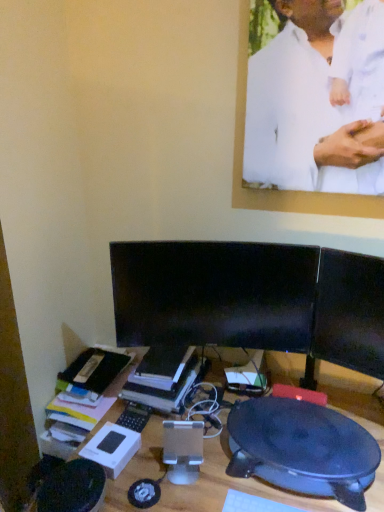
The height and width of the screenshot is (512, 384). Identify the location of black plastic round table at lower right. (302, 449).

Image resolution: width=384 pixels, height=512 pixels. What do you see at coordinates (349, 313) in the screenshot?
I see `black glossy monitor at center, positioned as the first computer monitor in right-to-left order` at bounding box center [349, 313].

Describe the element at coordinates (163, 377) in the screenshot. I see `hardcover book at center` at that location.

Identify the location of black glossy monitor at center, which is the first computer monitor in left-to-right order. Image resolution: width=384 pixels, height=512 pixels. (214, 294).

From the image's perspective, between black plastic desk at center and black plastic round table at lower right, who is located below?

black plastic desk at center.

Which is nearer, (x=255, y=481) or (x=255, y=454)?

Clearly, point (x=255, y=481) is closer to the camera than point (x=255, y=454).

Is black plastic desk at center to the right of black plastic round table at lower right from the viewer's perspective?

In fact, black plastic desk at center is to the left of black plastic round table at lower right.

In terms of height, does white matte shirt at upper center look taller or shorter compared to black glossy monitor at center, positioned as the first computer monitor in right-to-left order?

white matte shirt at upper center is taller than black glossy monitor at center, positioned as the first computer monitor in right-to-left order.

Which is in front, white matte shirt at upper center or black glossy monitor at center, which is the second computer monitor in left-to-right order?

white matte shirt at upper center.

Is white matte shirt at upper center placed right next to black glossy monitor at center, positioned as the first computer monitor in right-to-left order?

white matte shirt at upper center and black glossy monitor at center, positioned as the first computer monitor in right-to-left order, are not in contact.

From a real-world perspective, is white matte shirt at upper center above or below black glossy monitor at center, which is the second computer monitor in left-to-right order?

white matte shirt at upper center is situated higher than black glossy monitor at center, which is the second computer monitor in left-to-right order, in the real world.

Does hardcover book at center come behind black glossy monitor at center, positioned as the first computer monitor in right-to-left order?

Yes, it is.

Is point (129, 393) positioned in front of point (321, 322)?

No, it is behind (321, 322).

Can you confirm if hardcover book at center is wider than black glossy monitor at center, which is the second computer monitor in left-to-right order?

Yes.

Is the surface of hardcover book at center in direct contact with black glossy monitor at center, positioned as the first computer monitor in right-to-left order?

No, hardcover book at center is not with black glossy monitor at center, positioned as the first computer monitor in right-to-left order.

Relative to white matte shirt at upper center, is black glossy monitor at center, the second computer monitor positioned from the right, in front or behind?

In the image, black glossy monitor at center, the second computer monitor positioned from the right, appears behind white matte shirt at upper center.

Which is more to the left, black glossy monitor at center, which is the first computer monitor in left-to-right order, or white matte shirt at upper center?

black glossy monitor at center, which is the first computer monitor in left-to-right order, is more to the left.

Are black glossy monitor at center, the second computer monitor positioned from the right, and white matte shirt at upper center beside each other?

There is a gap between black glossy monitor at center, the second computer monitor positioned from the right, and white matte shirt at upper center.

Between point (188, 271) and point (353, 116), which one is positioned behind?

The point (188, 271) is behind.

Does white matte shirt at upper center come behind black plastic round table at lower right?

Yes, the depth of white matte shirt at upper center is greater than that of black plastic round table at lower right.

Consider the image. Is white matte shirt at upper center wider or thinner than black plastic round table at lower right?

white matte shirt at upper center is thinner than black plastic round table at lower right.

From a real-world perspective, which is physically above, white matte shirt at upper center or black plastic round table at lower right?

In real-world perspective, white matte shirt at upper center is above.

Is black plastic round table at lower right situated inside black glossy monitor at center, positioned as the first computer monitor in right-to-left order, or outside?

black plastic round table at lower right is outside black glossy monitor at center, positioned as the first computer monitor in right-to-left order.

From the image's perspective, relative to black glossy monitor at center, which is the second computer monitor in left-to-right order, is black plastic round table at lower right above or below?

From the image's perspective, black plastic round table at lower right appears below black glossy monitor at center, which is the second computer monitor in left-to-right order.

Considering the positions of points (233, 407) and (322, 273), is point (233, 407) closer to camera compared to point (322, 273)?

That is False.

Between black plastic round table at lower right and black glossy monitor at center, which is the second computer monitor in left-to-right order, which one has smaller width?

With smaller width is black glossy monitor at center, which is the second computer monitor in left-to-right order.

From a real-world perspective, who is located higher, hardcover book at center or white matte shirt at upper center?

white matte shirt at upper center, from a real-world perspective.

Considering the relative sizes of hardcover book at center and white matte shirt at upper center in the image provided, is hardcover book at center thinner than white matte shirt at upper center?

No, hardcover book at center is not thinner than white matte shirt at upper center.

Which is more to the left, hardcover book at center or white matte shirt at upper center?

From the viewer's perspective, hardcover book at center appears more on the left side.

Locate an element on the screen. desk located in front of the black plastic round table at lower right is located at coordinates (225, 486).

Image resolution: width=384 pixels, height=512 pixels. Identify the location of computer monitor on the right side of white matte shirt at upper center. (349, 313).

Considering their positions, is black glossy monitor at center, which is the second computer monitor in left-to-right order, positioned further to black plastic desk at center than black plastic round table at lower right?

The object further to black plastic desk at center is black glossy monitor at center, which is the second computer monitor in left-to-right order.

Which object lies nearer to the anchor point white matte shirt at upper center, hardcover book at center or black glossy monitor at center, the second computer monitor positioned from the right?

Among the two, black glossy monitor at center, the second computer monitor positioned from the right, is located nearer to white matte shirt at upper center.

From the picture: Looking at the image, which one is located further to black glossy monitor at center, which is the first computer monitor in left-to-right order, hardcover book at center or black glossy monitor at center, positioned as the first computer monitor in right-to-left order?

The object further to black glossy monitor at center, which is the first computer monitor in left-to-right order, is hardcover book at center.

From the image, which object appears to be nearer to black plastic round table at lower right, white matte shirt at upper center or black plastic desk at center?

The object closer to black plastic round table at lower right is black plastic desk at center.

In the scene shown: When comparing their distances from hardcover book at center, does black plastic desk at center or black plastic round table at lower right seem further?

black plastic round table at lower right is further to hardcover book at center.

Which object lies further to the anchor point black plastic desk at center, black glossy monitor at center, which is the second computer monitor in left-to-right order, or black glossy monitor at center, the second computer monitor positioned from the right?

black glossy monitor at center, which is the second computer monitor in left-to-right order, is further to black plastic desk at center.

From the image, which object appears to be farther from black glossy monitor at center, which is the first computer monitor in left-to-right order, white matte shirt at upper center or black glossy monitor at center, positioned as the first computer monitor in right-to-left order?

white matte shirt at upper center lies further to black glossy monitor at center, which is the first computer monitor in left-to-right order, than the other object.

Which object lies nearer to the anchor point black plastic round table at lower right, black glossy monitor at center, which is the first computer monitor in left-to-right order, or white matte shirt at upper center?

black glossy monitor at center, which is the first computer monitor in left-to-right order, is closer to black plastic round table at lower right.

Where is `book between black glossy monitor at center, the second computer monitor positioned from the right, and black plastic round table at lower right vertically`? This screenshot has height=512, width=384. book between black glossy monitor at center, the second computer monitor positioned from the right, and black plastic round table at lower right vertically is located at coordinates (163, 377).

Locate an element on the screen. This screenshot has width=384, height=512. book that lies between black glossy monitor at center, positioned as the first computer monitor in right-to-left order, and black plastic desk at center from top to bottom is located at coordinates (163, 377).

Where is `round table between black plastic desk at center and hardcover book at center from front to back`? Image resolution: width=384 pixels, height=512 pixels. round table between black plastic desk at center and hardcover book at center from front to back is located at coordinates (302, 449).

Find the location of a particular element. computer monitor between black glossy monitor at center, the second computer monitor positioned from the right, and black plastic round table at lower right, in the vertical direction is located at coordinates click(x=349, y=313).